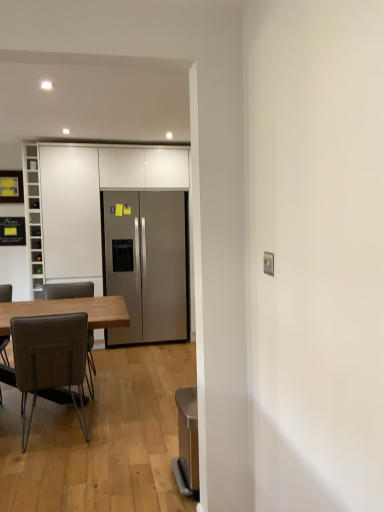
Question: Is the depth of brown leather chair at left, marked as the second chair in a front-to-back arrangement, greater than that of wooden table at left?

Choices:
 (A) no
 (B) yes

Answer: (B)

Question: Can you confirm if brown leather chair at left, marked as the second chair in a front-to-back arrangement, is thinner than wooden table at left?

Choices:
 (A) yes
 (B) no

Answer: (A)

Question: Is brown leather chair at left, marked as the second chair in a front-to-back arrangement, not close to wooden table at left?

Choices:
 (A) yes
 (B) no

Answer: (A)

Question: Considering the relative sizes of brown leather chair at left, positioned as the first chair in back-to-front order, and wooden table at left in the image provided, is brown leather chair at left, positioned as the first chair in back-to-front order, smaller than wooden table at left?

Choices:
 (A) yes
 (B) no

Answer: (A)

Question: Can you confirm if brown leather chair at left, marked as the second chair in a front-to-back arrangement, is wider than wooden table at left?

Choices:
 (A) yes
 (B) no

Answer: (B)

Question: Considering their positions, is satin silver refrigerator at center located in front of or behind metallic gray trash can at lower right?

Choices:
 (A) behind
 (B) front

Answer: (A)

Question: From a real-world perspective, relative to metallic gray trash can at lower right, is satin silver refrigerator at center vertically above or below?

Choices:
 (A) above
 (B) below

Answer: (A)

Question: From the image's perspective, is satin silver refrigerator at center above or below metallic gray trash can at lower right?

Choices:
 (A) above
 (B) below

Answer: (A)

Question: Considering the positions of satin silver refrigerator at center and metallic gray trash can at lower right in the image, is satin silver refrigerator at center bigger or smaller than metallic gray trash can at lower right?

Choices:
 (A) small
 (B) big

Answer: (B)

Question: In terms of size, does wooden table at left appear bigger or smaller than brown leather chair at left, positioned as the first chair in back-to-front order?

Choices:
 (A) big
 (B) small

Answer: (A)

Question: From a real-world perspective, is wooden table at left physically located above or below brown leather chair at left, positioned as the first chair in back-to-front order?

Choices:
 (A) above
 (B) below

Answer: (B)

Question: Relative to brown leather chair at left, marked as the second chair in a front-to-back arrangement, is wooden table at left in front or behind?

Choices:
 (A) behind
 (B) front

Answer: (B)

Question: Would you say wooden table at left is to the left or to the right of brown leather chair at left, marked as the second chair in a front-to-back arrangement, in the picture?

Choices:
 (A) right
 (B) left

Answer: (B)

Question: Visually, is wooden table at left positioned to the left or to the right of white glossy cabinets at center, the first cabinetry viewed from the right?

Choices:
 (A) right
 (B) left

Answer: (B)

Question: Choose the correct answer: Is wooden table at left inside white glossy cabinets at center, which is the second cabinetry in left-to-right order, or outside it?

Choices:
 (A) inside
 (B) outside

Answer: (B)